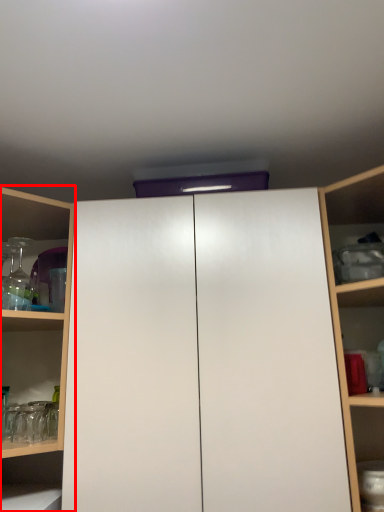
Question: From the image's perspective, what is the correct spatial relationship of shelf (annotated by the red box) in relation to cupboard?

Choices:
 (A) above
 (B) below

Answer: (A)